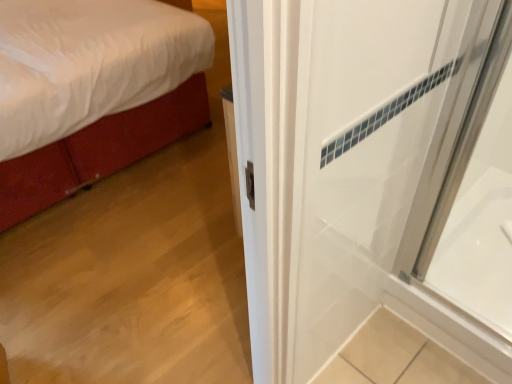
Question: From a real-world perspective, is white glossy bathtub at right physically located above or below velvet red bed at left?

Choices:
 (A) above
 (B) below

Answer: (B)

Question: Is white glossy bathtub at right taller or shorter than velvet red bed at left?

Choices:
 (A) tall
 (B) short

Answer: (B)

Question: Is point (486, 165) positioned closer to the camera than point (136, 94)?

Choices:
 (A) farther
 (B) closer

Answer: (B)

Question: From their relative heights in the image, would you say velvet red bed at left is taller or shorter than white glossy bathtub at right?

Choices:
 (A) short
 (B) tall

Answer: (B)

Question: Considering the positions of velvet red bed at left and white glossy bathtub at right in the image, is velvet red bed at left wider or thinner than white glossy bathtub at right?

Choices:
 (A) wide
 (B) thin

Answer: (A)

Question: Choose the correct answer: Is velvet red bed at left inside white glossy bathtub at right or outside it?

Choices:
 (A) inside
 (B) outside

Answer: (B)

Question: Considering the positions of velvet red bed at left and white glossy bathtub at right in the image, is velvet red bed at left bigger or smaller than white glossy bathtub at right?

Choices:
 (A) big
 (B) small

Answer: (A)